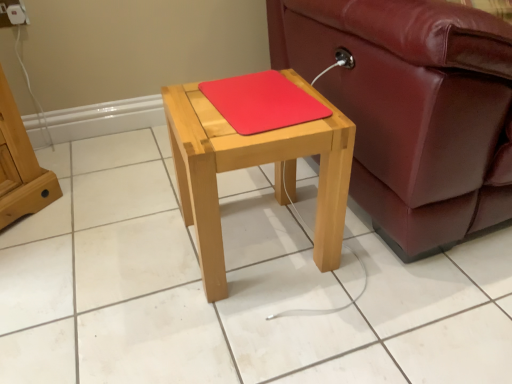
Identify the location of vacant space to the right of natural wood table at center. This screenshot has height=384, width=512. (384, 270).